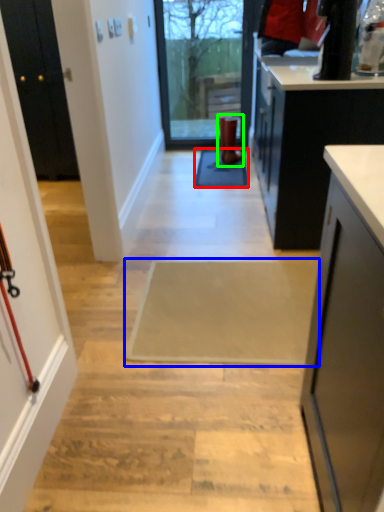
Question: Which is farther away from doormat (highlighted by a red box)? doormat (highlighted by a blue box) or footwear (highlighted by a green box)?

Choices:
 (A) doormat
 (B) footwear

Answer: (A)